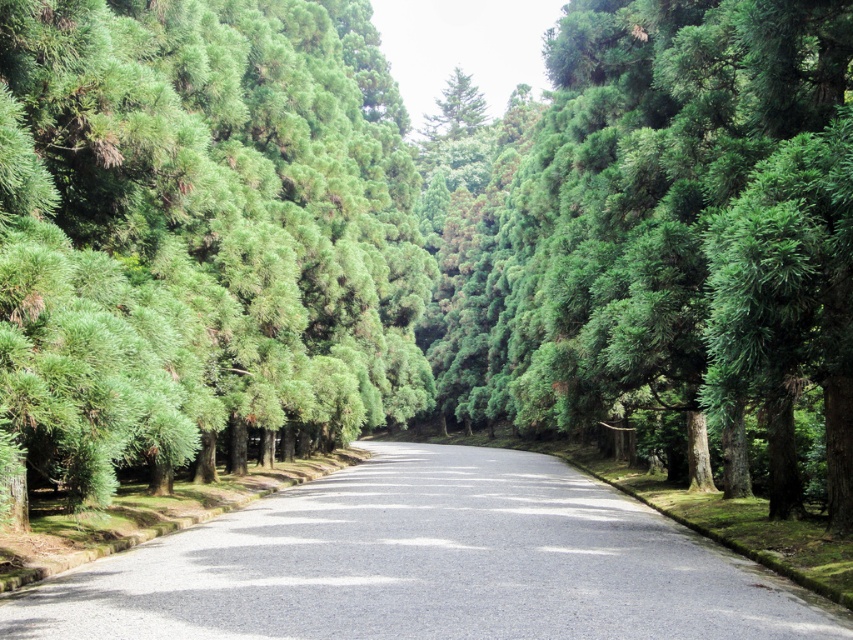
Does green leafy trees at left appear on the left side of asphalt road at center?

Indeed, green leafy trees at left is positioned on the left side of asphalt road at center.

Is green leafy trees at left closer to the viewer compared to asphalt road at center?

Yes, it is.

At what (x,y) coordinates should I click in order to perform the action: click on green leafy trees at left. Please return your answer as a coordinate pair (x, y). The width and height of the screenshot is (853, 640). Looking at the image, I should click on (201, 236).